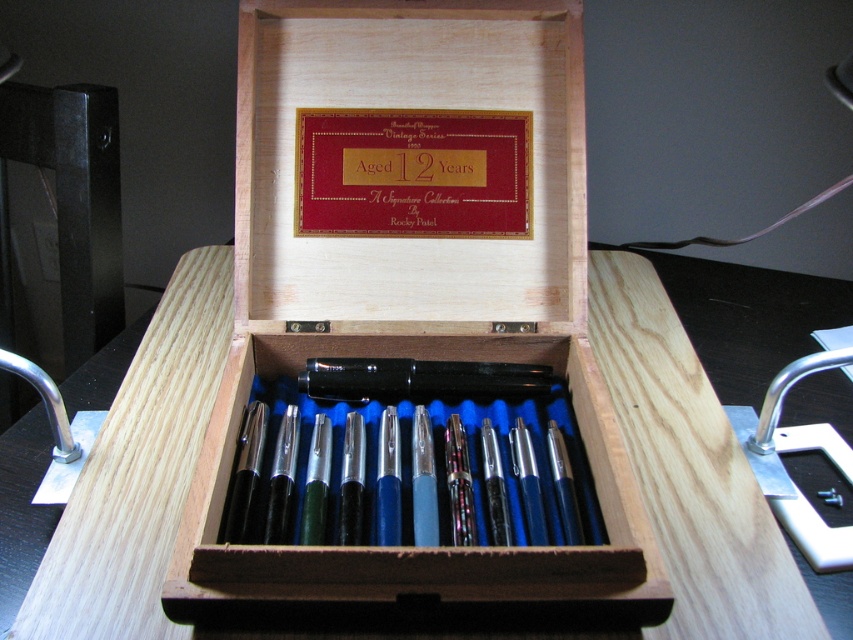
Question: Can you confirm if wooden box at center is positioned to the right of wooden table at center?

Choices:
 (A) no
 (B) yes

Answer: (A)

Question: Does wooden box at center appear under wooden table at center?

Choices:
 (A) no
 (B) yes

Answer: (A)

Question: Which of the following is the farthest from the observer?

Choices:
 (A) (149, 577)
 (B) (248, 179)

Answer: (B)

Question: Can you confirm if wooden box at center is positioned above wooden table at center?

Choices:
 (A) no
 (B) yes

Answer: (B)

Question: Among these points, which one is nearest to the camera?

Choices:
 (A) (39, 605)
 (B) (566, 76)

Answer: (A)